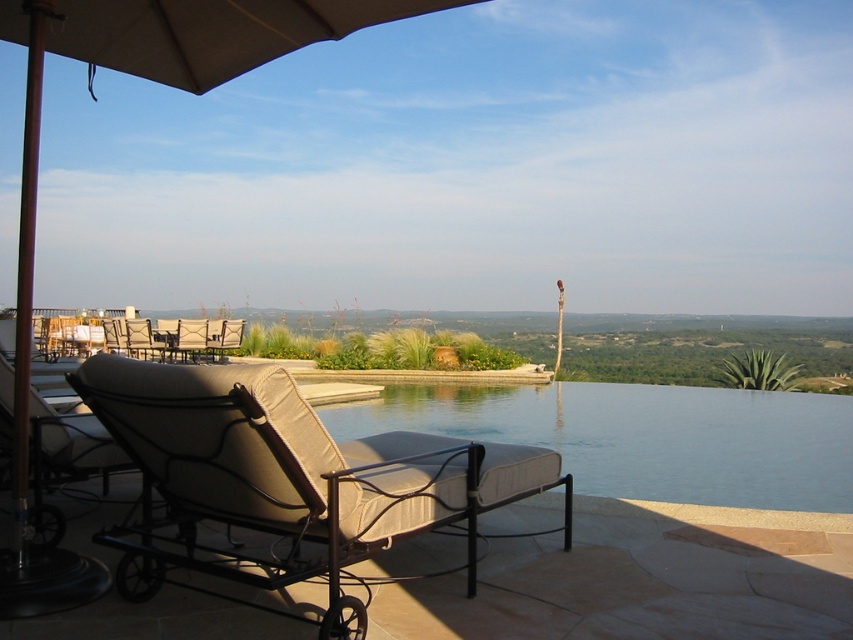
You are planning to set up a new table in the patio area. The table needs to be placed between the beige fabric umbrella at upper left and the beige fabric chair at lower left. Considering their widths, which object should you place closer to the center of the patio to ensure the table fits properly?

The beige fabric umbrella at upper left is wider than the beige fabric chair at lower left. To ensure the table fits properly, you should place the wider beige fabric umbrella at upper left closer to the center, allowing more space for the narrower chair on the side.

You are a guest at this resort and want to enjoy the shade provided by the beige fabric umbrella at upper left while lying on the beige fabric chaise lounge at lower left. Based on their positions, can you determine if the umbrella will cast shade over the chaise lounge?

The beige fabric chaise lounge at lower left is below the beige fabric umbrella at upper left, so the umbrella is positioned above the chaise lounge. Since the umbrella is above and the chaise lounge is below, the shade from the umbrella should cover the chaise lounge, allowing you to enjoy the shade while lying there.